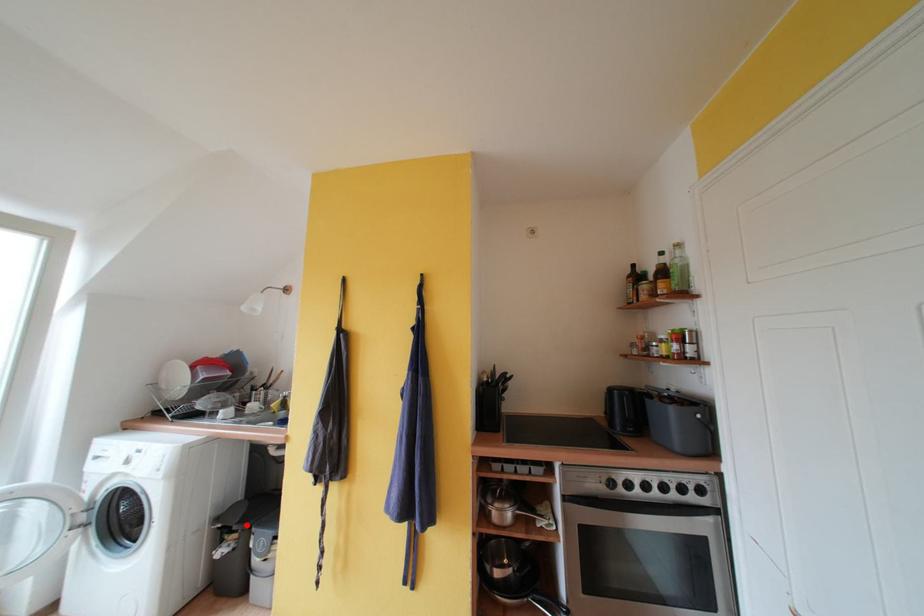
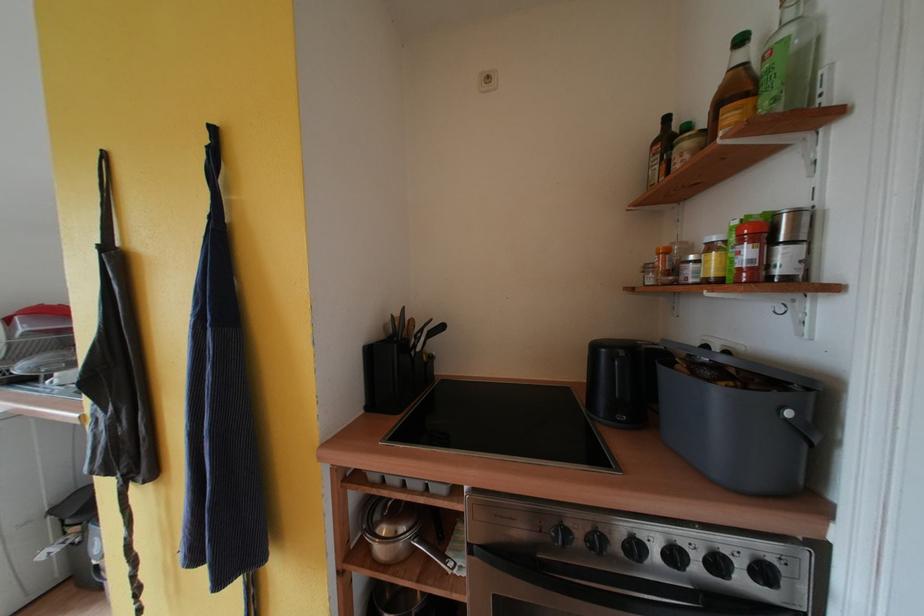
Find the pixel in the second image that matches the highlighted location in the first image.

(83, 517)